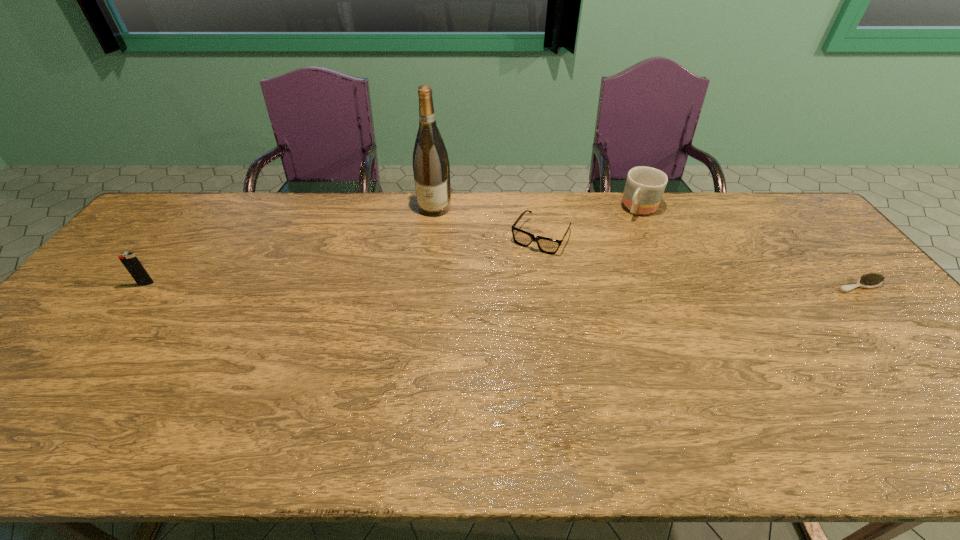
Locate an element on the screen. The height and width of the screenshot is (540, 960). free spot on the desktop that is between the leftmost object and the scrubbing brush and is positioned on the side with the handle of the mug is located at coordinates (585, 285).

Locate an element on the screen. free space on the desktop that is between the leftmost object and the rightmost object and is positioned on the label of the tallest object is located at coordinates (408, 285).

I want to click on vacant space on the desktop that is between the igniter and the shortest object and is positioned on the front-facing side of the sunglasses, so click(510, 285).